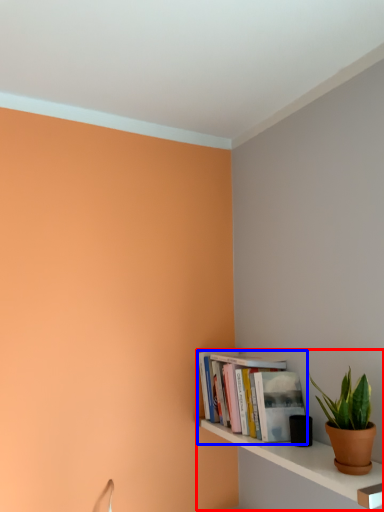
Question: Which of the following is the farthest to the observer, shelf (highlighted by a red box) or book (highlighted by a blue box)?

Choices:
 (A) shelf
 (B) book

Answer: (B)